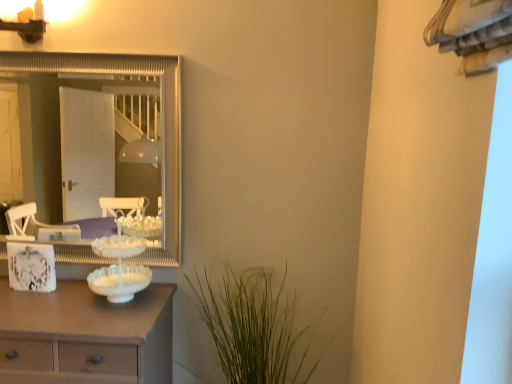
Question: Considering the relative positions of green leafy plant at lower center and white frosted glass candle holder at center in the image provided, is green leafy plant at lower center to the right of white frosted glass candle holder at center from the viewer's perspective?

Choices:
 (A) yes
 (B) no

Answer: (A)

Question: Would you say green leafy plant at lower center is outside white frosted glass candle holder at center?

Choices:
 (A) yes
 (B) no

Answer: (A)

Question: Is green leafy plant at lower center turned away from white frosted glass candle holder at center?

Choices:
 (A) no
 (B) yes

Answer: (A)

Question: Is green leafy plant at lower center further to the viewer compared to white frosted glass candle holder at center?

Choices:
 (A) no
 (B) yes

Answer: (A)

Question: Is green leafy plant at lower center with white frosted glass candle holder at center?

Choices:
 (A) no
 (B) yes

Answer: (A)

Question: Does point (138, 248) appear closer or farther from the camera than point (49, 382)?

Choices:
 (A) farther
 (B) closer

Answer: (A)

Question: From the image's perspective, is white frosted glass candle holder at center located above or below white wood chest of drawers at left?

Choices:
 (A) below
 (B) above

Answer: (B)

Question: Is white frosted glass candle holder at center taller or shorter than white wood chest of drawers at left?

Choices:
 (A) tall
 (B) short

Answer: (B)

Question: Do you think white frosted glass candle holder at center is within white wood chest of drawers at left, or outside of it?

Choices:
 (A) outside
 (B) inside

Answer: (A)

Question: From a real-world perspective, is white frosted glass candle holder at center above or below matte gold sconce at upper left?

Choices:
 (A) above
 (B) below

Answer: (B)

Question: Is point (116, 241) positioned closer to the camera than point (41, 23)?

Choices:
 (A) farther
 (B) closer

Answer: (A)

Question: Considering the positions of white frosted glass candle holder at center and matte gold sconce at upper left in the image, is white frosted glass candle holder at center taller or shorter than matte gold sconce at upper left?

Choices:
 (A) tall
 (B) short

Answer: (A)

Question: Is white frosted glass candle holder at center in front of or behind matte gold sconce at upper left in the image?

Choices:
 (A) front
 (B) behind

Answer: (A)

Question: Is silver/metallic mirror at upper left spatially inside white frosted glass candle holder at center, or outside of it?

Choices:
 (A) outside
 (B) inside

Answer: (A)

Question: From the image's perspective, is silver/metallic mirror at upper left positioned above or below white frosted glass candle holder at center?

Choices:
 (A) above
 (B) below

Answer: (A)